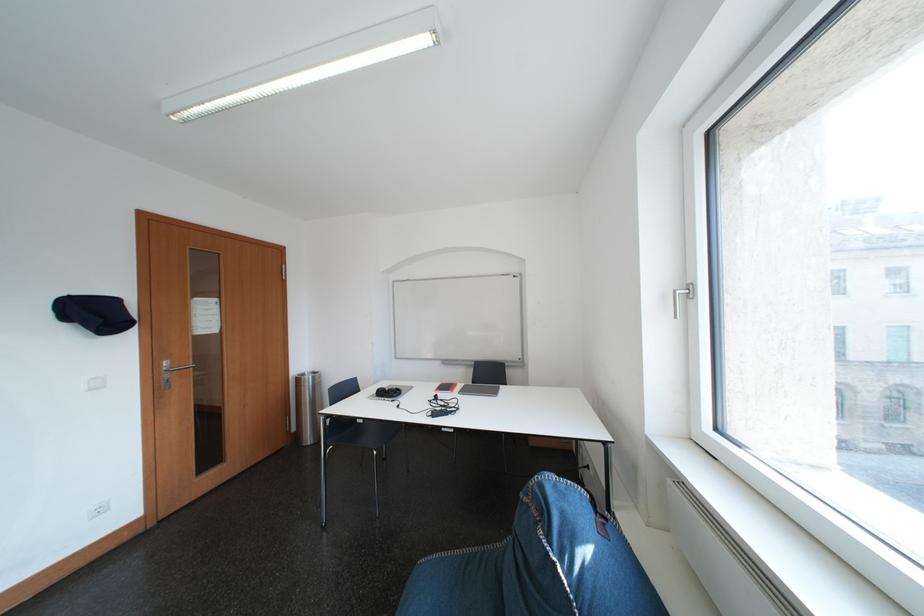
Where is `white light switch`? The height and width of the screenshot is (616, 924). white light switch is located at coordinates (99, 509).